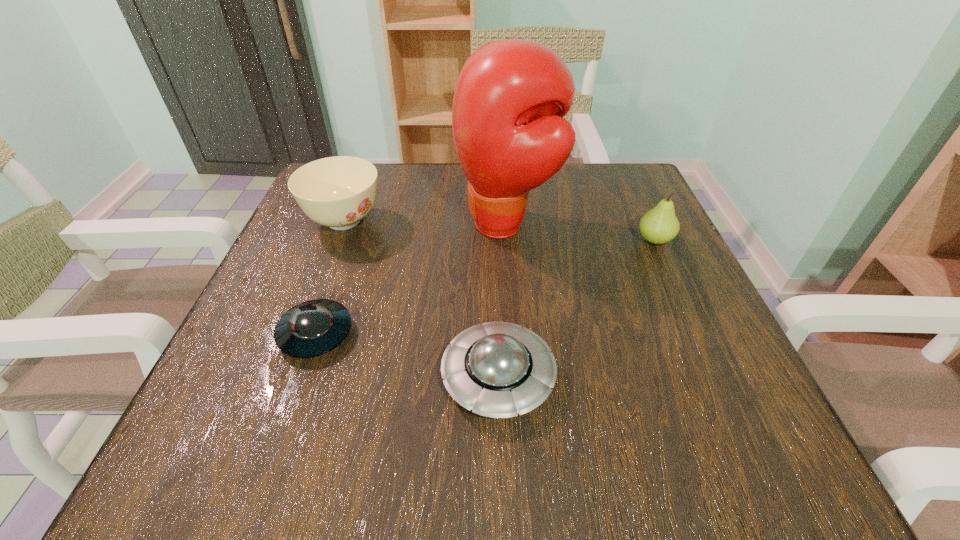
The image size is (960, 540). What are the coordinates of `blank space located on the left of the pear` in the screenshot? It's located at (469, 240).

Locate an element on the screen. free space located 0.110m on the right of the sugar bowl is located at coordinates (436, 221).

What are the coordinates of `free location located on the left of the taller saucer` in the screenshot? It's located at (315, 377).

Locate an element on the screen. This screenshot has height=540, width=960. vacant area situated 0.080m on the back of the left saucer is located at coordinates (336, 275).

Where is `boxing glove at the far edge`? Image resolution: width=960 pixels, height=540 pixels. boxing glove at the far edge is located at coordinates (511, 95).

The image size is (960, 540). I want to click on sugar bowl at the far edge, so click(x=338, y=192).

At what (x,y) coordinates should I click in order to perform the action: click on object situated at the near edge. Please return your answer as a coordinate pair (x, y). Looking at the image, I should click on (498, 369).

I want to click on sugar bowl that is at the left edge, so click(338, 192).

Identify the location of saucer located at the left edge. (311, 328).

Locate an element on the screen. This screenshot has height=540, width=960. object present at the right edge is located at coordinates (659, 225).